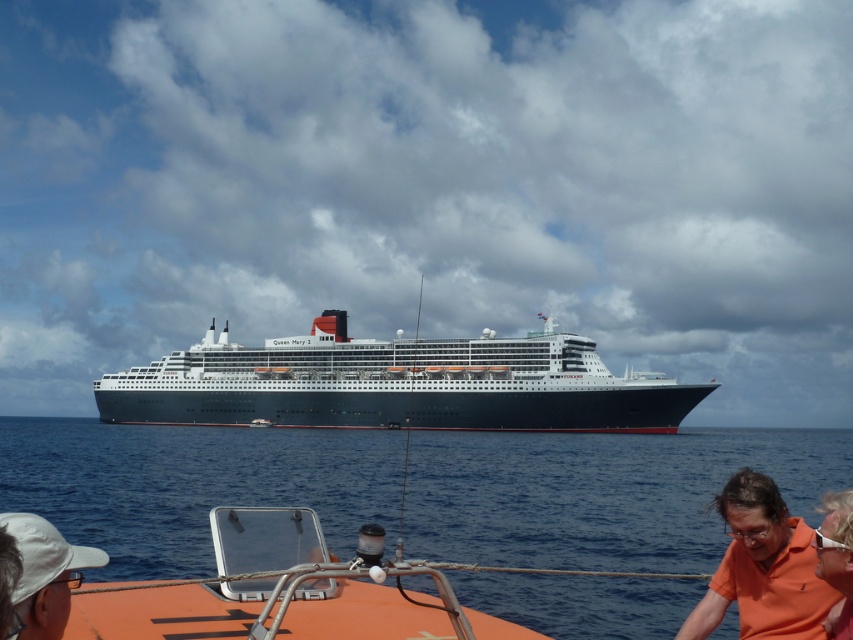
Question: Is white fabric cap at lower left in front of orange fabric at lower right?

Choices:
 (A) no
 (B) yes

Answer: (B)

Question: Considering the relative positions of blue water at center and white fabric cap at lower left in the image provided, where is blue water at center located with respect to white fabric cap at lower left?

Choices:
 (A) left
 (B) right

Answer: (B)

Question: Among these points, which one is farthest from the camera?

Choices:
 (A) coord(451,397)
 (B) coord(746,586)
 (C) coord(734,429)
 (D) coord(837,513)

Answer: (C)

Question: Is blue water at center positioned before orange cotton shirt at lower right?

Choices:
 (A) no
 (B) yes

Answer: (A)

Question: Which of the following is the farthest from the observer?

Choices:
 (A) (660, 582)
 (B) (15, 529)
 (C) (679, 420)

Answer: (C)

Question: Estimate the real-world distances between objects in this image. Which object is closer to the blue water at center?

Choices:
 (A) orange fabric at lower right
 (B) dark blue metallic ship at center
 (C) white fabric cap at lower left

Answer: (B)